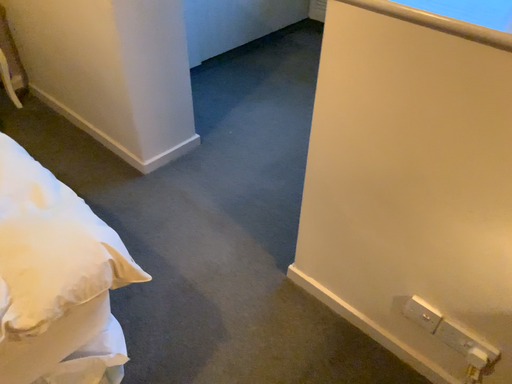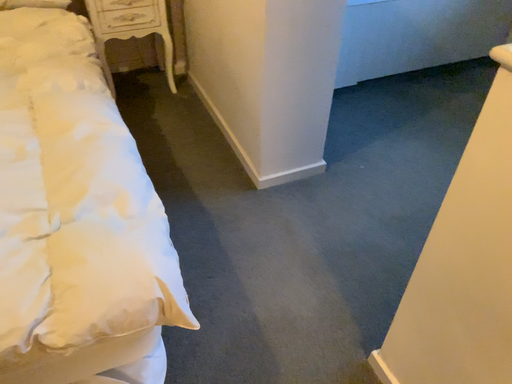
Question: Which way did the camera rotate in the video?

Choices:
 (A) rotated right
 (B) rotated left

Answer: (B)